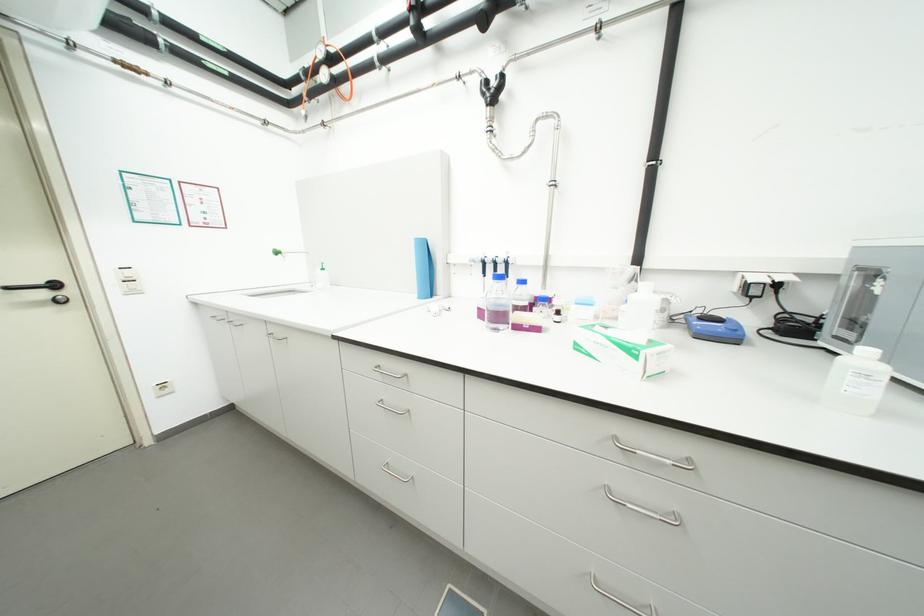
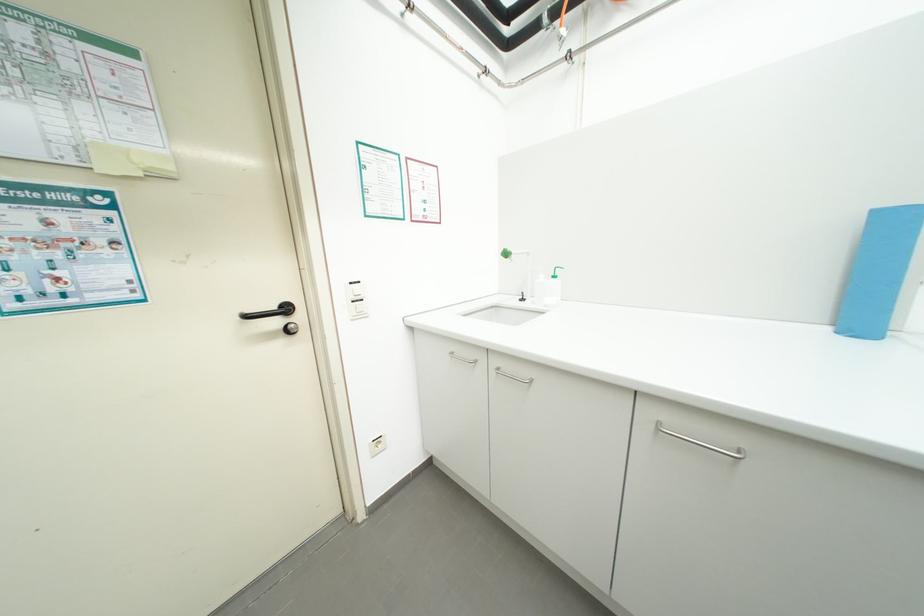
Find the pixel in the second image that matches (52,296) in the first image.

(285, 323)